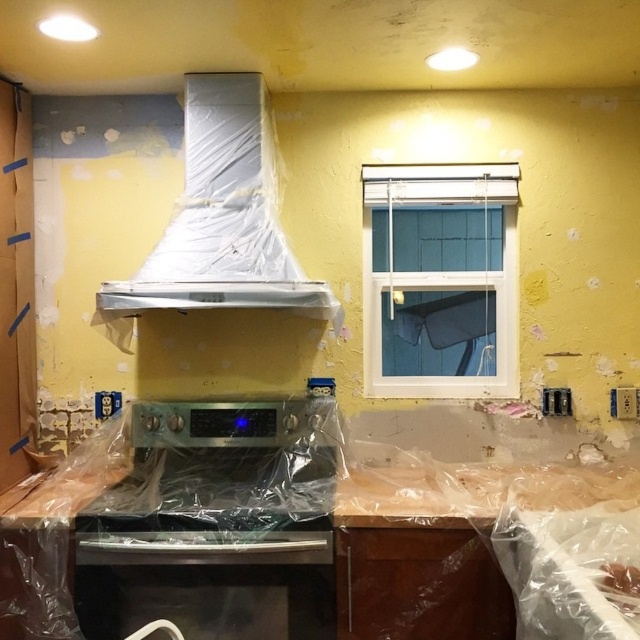
Question: Can you confirm if satin silver oven at center is positioned above white plastic exhaust hood at upper center?

Choices:
 (A) no
 (B) yes

Answer: (A)

Question: Can you confirm if satin silver oven at center is thinner than white plastic exhaust hood at upper center?

Choices:
 (A) no
 (B) yes

Answer: (A)

Question: Which point is closer to the camera?

Choices:
 (A) (125, 492)
 (B) (200, 260)

Answer: (A)

Question: Which object appears farthest from the camera in this image?

Choices:
 (A) satin silver oven at center
 (B) white plastic exhaust hood at upper center

Answer: (B)

Question: Can you confirm if satin silver oven at center is positioned below white plastic exhaust hood at upper center?

Choices:
 (A) yes
 (B) no

Answer: (A)